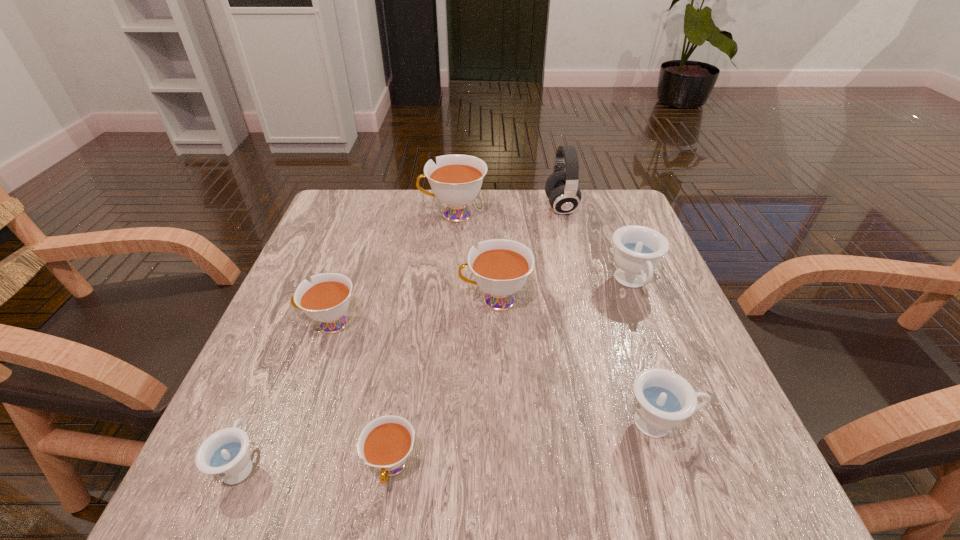
I want to click on vacant area between the headset and the smallest white teacup, so click(476, 337).

Where is `empty space that is in between the nearest white teacup and the third biggest white teacup`? This screenshot has height=540, width=960. empty space that is in between the nearest white teacup and the third biggest white teacup is located at coordinates [361, 395].

Identify the location of free space that is in between the smallest white teacup and the farthest blue teacup. This screenshot has width=960, height=540. (512, 375).

This screenshot has height=540, width=960. In order to click on free space that is in between the tallest object and the second smallest white teacup in this screenshot , I will do `click(445, 265)`.

Locate which object is the second closest to the second smallest white teacup. Please provide its 2D coordinates. Your answer should be formatted as a tuple, i.e. [(x, y)], where the tuple contains the x and y coordinates of a point satisfying the conditions above.

[(501, 266)]

Locate which object is the seventh closest to the farthest blue teacup. Please provide its 2D coordinates. Your answer should be formatted as a tuple, i.e. [(x, y)], where the tuple contains the x and y coordinates of a point satisfying the conditions above.

[(225, 455)]

Select which teacup is the fifth closest to the leftmost white teacup. Please provide its 2D coordinates. Your answer should be formatted as a tuple, i.e. [(x, y)], where the tuple contains the x and y coordinates of a point satisfying the conditions above.

[(663, 399)]

Identify which teacup is the fifth nearest to the leftmost blue teacup. Please provide its 2D coordinates. Your answer should be formatted as a tuple, i.e. [(x, y)], where the tuple contains the x and y coordinates of a point satisfying the conditions above.

[(456, 180)]

In order to click on the fourth closest white teacup to the biggest blue teacup in this screenshot , I will do `click(326, 299)`.

The width and height of the screenshot is (960, 540). What are the coordinates of `white teacup identified as the third closest to the headset` in the screenshot? It's located at (326, 299).